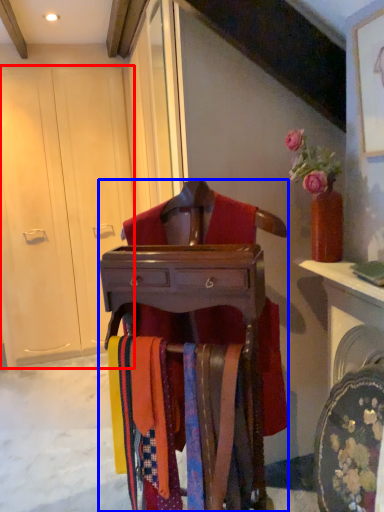
Question: Which of the following is the farthest to the observer, armoire (highlighted by a red box) or furniture (highlighted by a blue box)?

Choices:
 (A) armoire
 (B) furniture

Answer: (A)